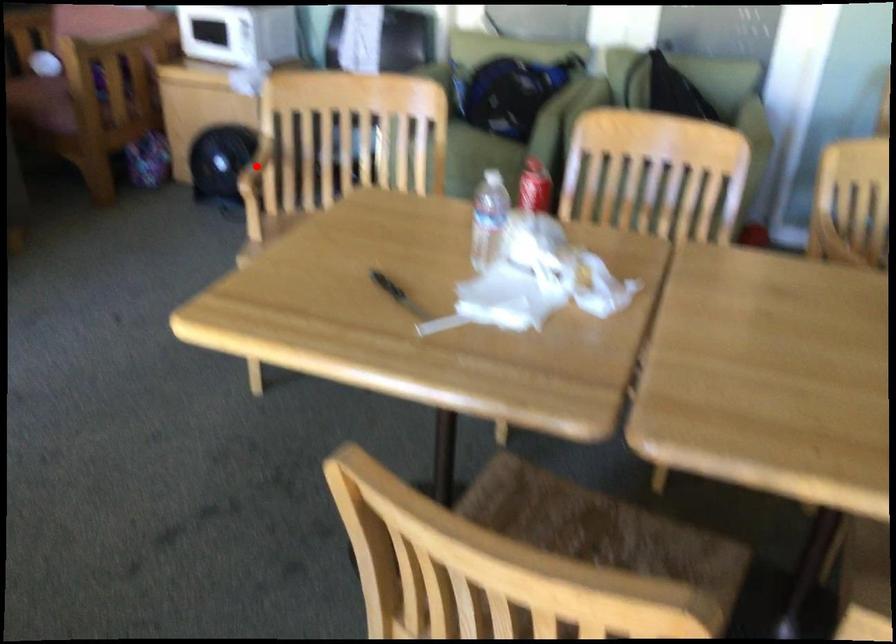
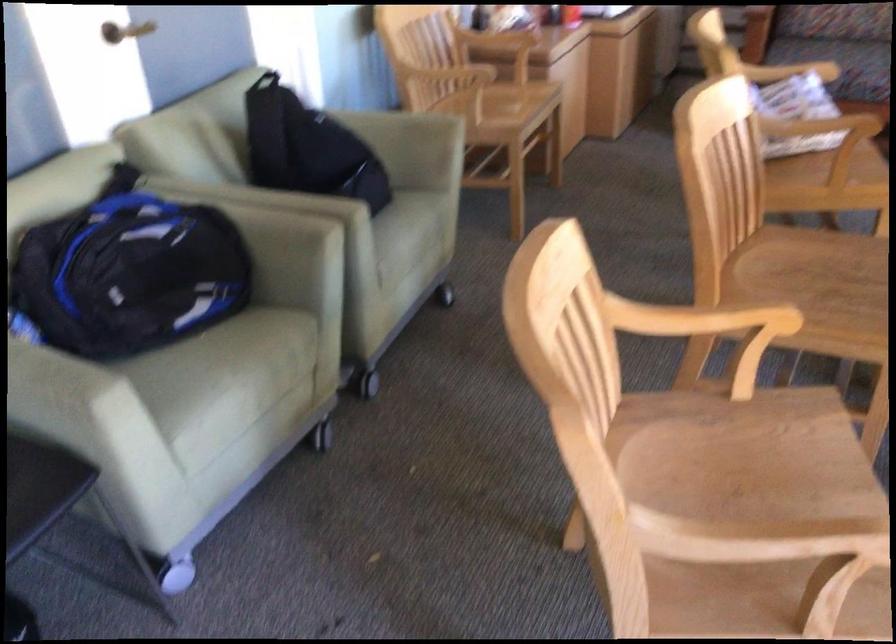
Question: I am providing you with two images of the same scene from different viewpoints. A red point is marked on the first image. Can you still see the location of the red point in image 2?

Choices:
 (A) Yes
 (B) No

Answer: (B)